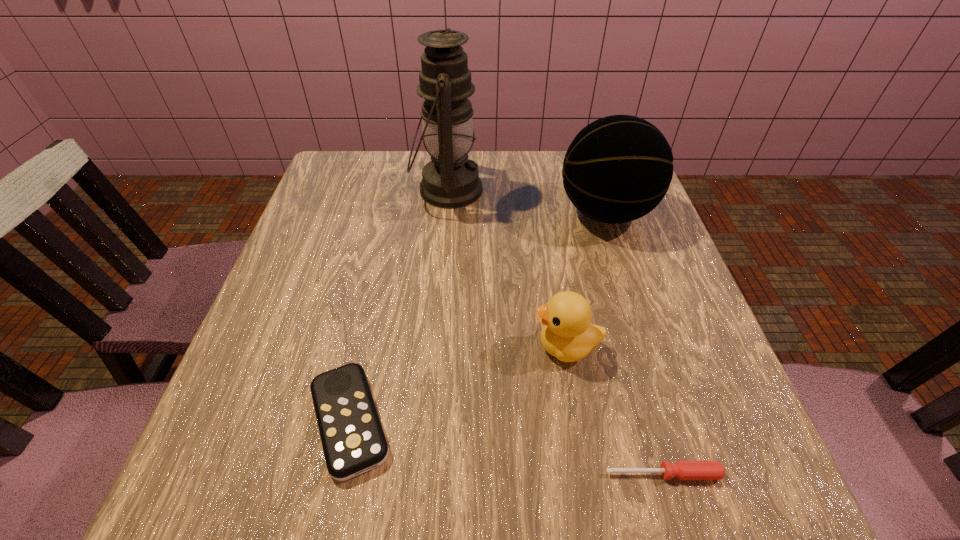
Identify the location of free location located on the face of the third tallest object. This screenshot has height=540, width=960. (448, 346).

The width and height of the screenshot is (960, 540). I want to click on vacant space located 0.050m on the back of the remote control, so click(x=366, y=346).

Locate an element on the screen. vacant space located 0.060m on the right of the shortest object is located at coordinates (762, 474).

Where is `oil lamp at the far edge`? This screenshot has width=960, height=540. oil lamp at the far edge is located at coordinates (450, 180).

Find the location of a particular element. The width and height of the screenshot is (960, 540). basketball located in the far edge section of the desktop is located at coordinates (617, 169).

Where is `remote control that is at the near edge`? remote control that is at the near edge is located at coordinates (353, 440).

At what (x,y) coordinates should I click in order to perform the action: click on screwdriver situated at the near edge. Please return your answer as a coordinate pair (x, y). The image size is (960, 540). Looking at the image, I should click on (684, 470).

Find the location of `object situated at the left edge`. object situated at the left edge is located at coordinates (353, 440).

At what (x,y) coordinates should I click in order to perform the action: click on basketball that is at the right edge. Please return your answer as a coordinate pair (x, y). The width and height of the screenshot is (960, 540). Looking at the image, I should click on [x=617, y=169].

The image size is (960, 540). Identify the location of screwdriver that is at the right edge. (684, 470).